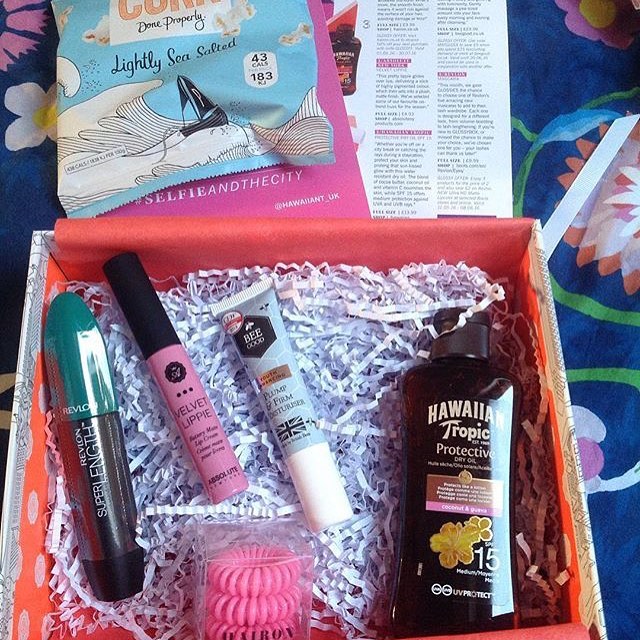
Locate an element on the screen. Image resolution: width=640 pixels, height=640 pixels. magazine is located at coordinates (470, 65).